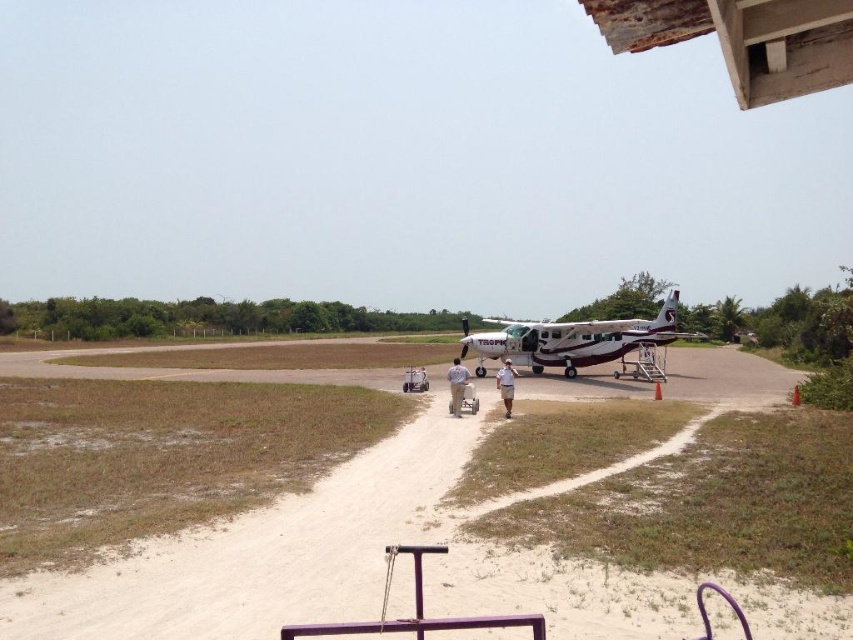
You are a photographer setting up a tripod to take a picture of the aircraft. You need to place the tripod on the brown sandy dirt track at lower left or the tan fabric shorts at center. Which surface is more suitable for the tripod?

The brown sandy dirt track at lower left is more suitable for the tripod because it is a stable surface compared to the tan fabric shorts at center, which are clothing and not a solid ground.